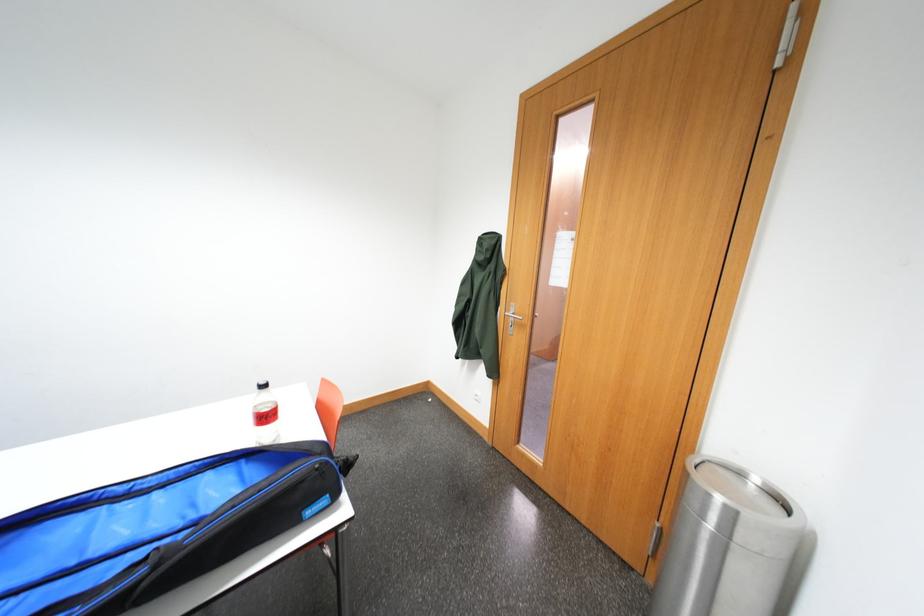
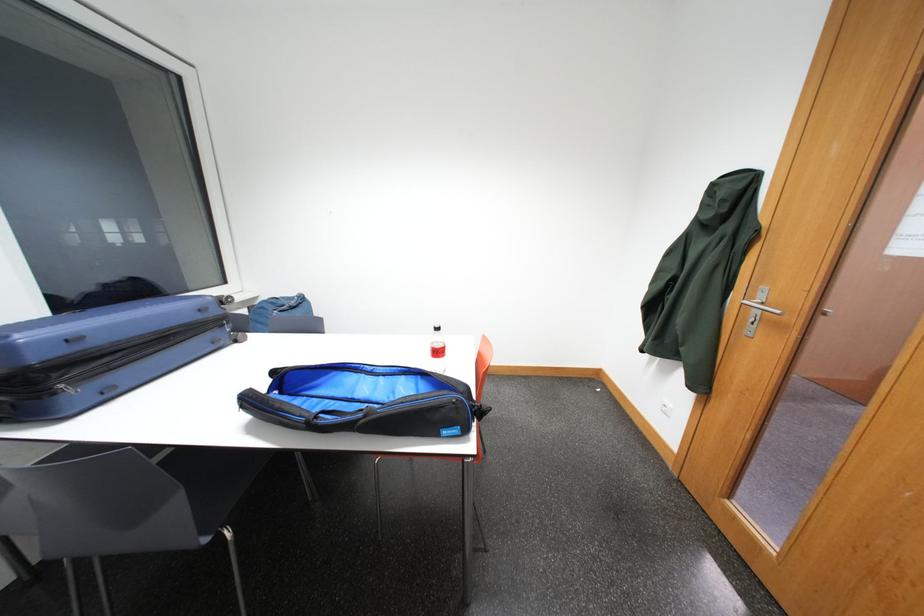
Question: How did the camera likely rotate?

Choices:
 (A) Left
 (B) Right
 (C) Up
 (D) Down

Answer: (A)